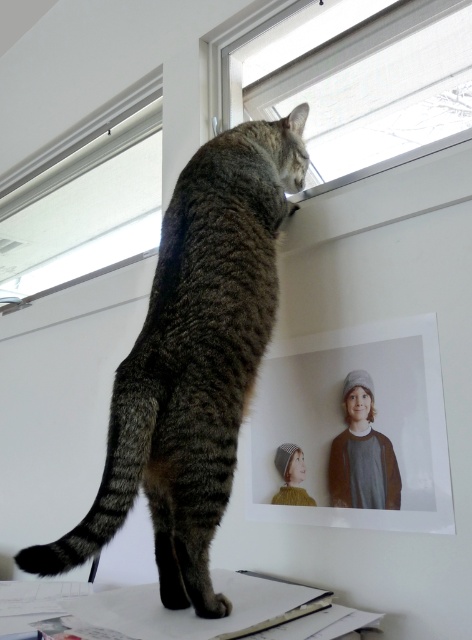
From the picture: Who is taller, tabby fur cat at upper center or white matte window at upper center?

With more height is tabby fur cat at upper center.

Between point (221, 460) and point (101, 212), which one is positioned in front?

Point (221, 460) is more forward.

The width and height of the screenshot is (472, 640). What do you see at coordinates (193, 360) in the screenshot?
I see `tabby fur cat at upper center` at bounding box center [193, 360].

This screenshot has height=640, width=472. I want to click on tabby fur cat at upper center, so click(193, 360).

Which is above, transparent glass window at upper center or white matte window at upper center?

transparent glass window at upper center is above.

Describe the element at coordinates (373, 90) in the screenshot. This screenshot has width=472, height=640. I see `transparent glass window at upper center` at that location.

Locate an element on the screen. transparent glass window at upper center is located at coordinates (373, 90).

Between matte paper photo at upper center and transparent glass window at upper center, which one appears on the right side from the viewer's perspective?

From the viewer's perspective, transparent glass window at upper center appears more on the right side.

Does matte paper photo at upper center appear on the left side of transparent glass window at upper center?

Indeed, matte paper photo at upper center is positioned on the left side of transparent glass window at upper center.

The image size is (472, 640). Find the location of `matte paper photo at upper center`. matte paper photo at upper center is located at coordinates (354, 429).